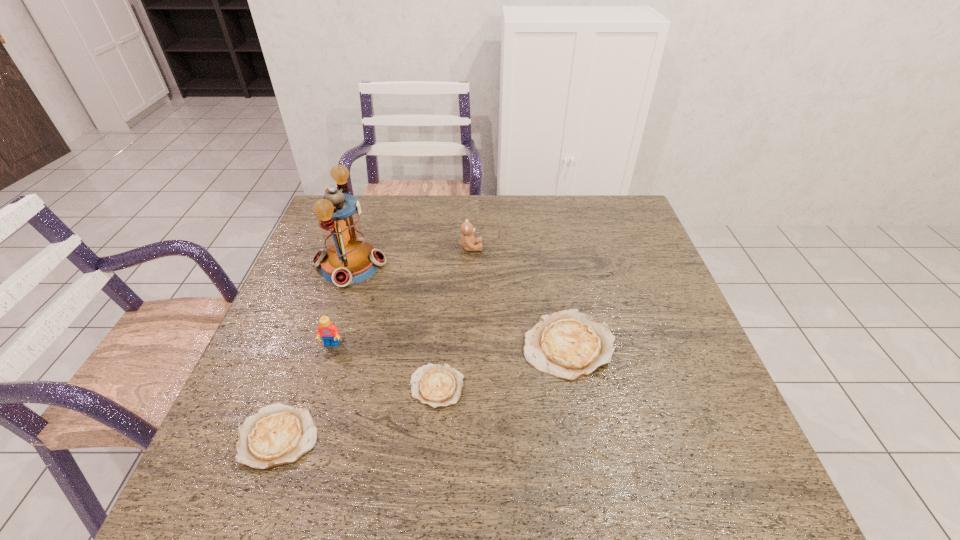
The image size is (960, 540). In order to click on free spot between the second tallest quiche and the second quiche from left to right in this screenshot , I will do `click(358, 412)`.

You are a GUI agent. You are given a task and a screenshot of the screen. Output one action in this format:
    pyautogui.click(x=<x>, y=<y>)
    Task: Click on the vacant space in between the second quiche from left to right and the fifth tallest object
    The image size is (960, 540).
    Given the screenshot: What is the action you would take?
    pyautogui.click(x=358, y=412)

The image size is (960, 540). Identify the location of vacant area between the teddy bear and the Lego. (401, 296).

Find the location of `the closest object relative to the leftmost quiche`. the closest object relative to the leftmost quiche is located at coordinates (327, 330).

Identify which object is the fifth nearest to the fifth tallest object. Please provide its 2D coordinates. Your answer should be formatted as a tuple, i.e. [(x, y)], where the tuple contains the x and y coordinates of a point satisfying the conditions above.

[(467, 241)]

You are a GUI agent. You are given a task and a screenshot of the screen. Output one action in this format:
    pyautogui.click(x=<x>, y=<y>)
    Task: Click on the second closest quiche to the second quiche from left to right
    
    Given the screenshot: What is the action you would take?
    pyautogui.click(x=278, y=434)

At what (x,y) coordinates should I click in order to perform the action: click on the second closest quiche relative to the shortest object. Please return your answer as a coordinate pair (x, y). Looking at the image, I should click on (278, 434).

The width and height of the screenshot is (960, 540). I want to click on blank space that satisfies the following two spatial constraints: 1. on the back side of the tallest quiche; 2. on the front-facing side of the teddy bear, so click(x=550, y=247).

Locate an element on the screen. This screenshot has width=960, height=540. blank area in the image that satisfies the following two spatial constraints: 1. on the back side of the second quiche from right to left; 2. on the right side of the second tallest quiche is located at coordinates (297, 387).

Find the location of `vacant space that satisfies the following two spatial constraints: 1. on the front-facing side of the teddy bear; 2. on the right side of the tallest quiche`. vacant space that satisfies the following two spatial constraints: 1. on the front-facing side of the teddy bear; 2. on the right side of the tallest quiche is located at coordinates (468, 345).